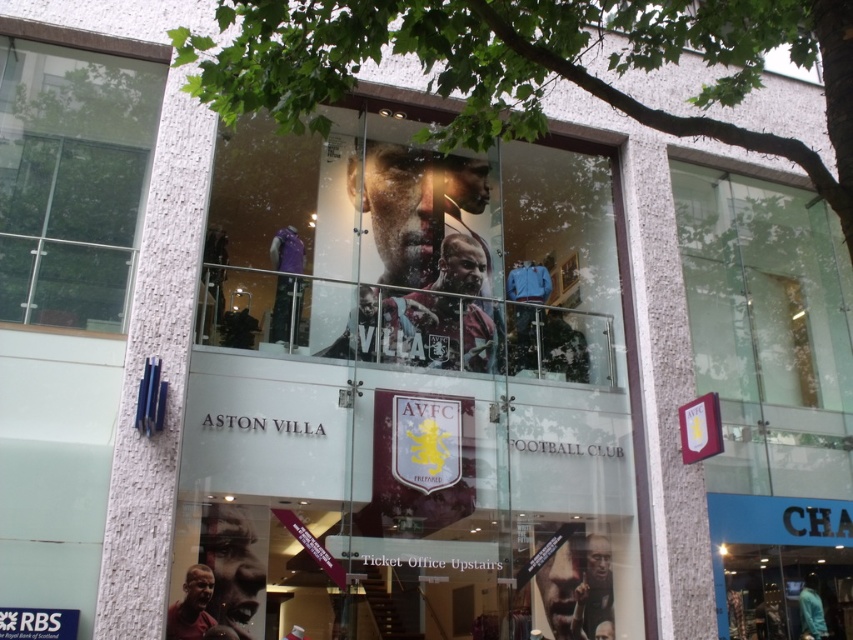
Question: Which point appears closest to the camera in this image?

Choices:
 (A) (202, 602)
 (B) (590, 568)

Answer: (A)

Question: Is matte glass poster at center smaller than clear glass window at upper left?

Choices:
 (A) yes
 (B) no

Answer: (B)

Question: Does maroon fabric banner at lower right appear over smooth skin face at lower left?

Choices:
 (A) no
 (B) yes

Answer: (B)

Question: Is maroon fabric banner at lower right wider than clear glass window at upper left?

Choices:
 (A) no
 (B) yes

Answer: (A)

Question: Which point is closer to the camera taking this photo?

Choices:
 (A) (51, 308)
 (B) (587, 541)
 (C) (225, 545)
 (D) (490, 156)

Answer: (A)

Question: Among these objects, which one is farthest from the camera?

Choices:
 (A) matte black jersey at center
 (B) matte glass poster at center

Answer: (A)